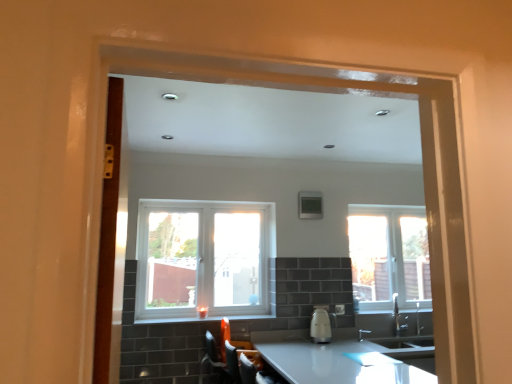
Image resolution: width=512 pixels, height=384 pixels. What do you see at coordinates (202, 258) in the screenshot? I see `white plastic window at center, which ranks as the 2th window in back-to-front order` at bounding box center [202, 258].

Measure the distance between white glossy kettle at center and camera.

white glossy kettle at center is 3.41 meters away from camera.

Where is `clear glass window at right, the second window viewed from the front`? clear glass window at right, the second window viewed from the front is located at coordinates (389, 255).

Image resolution: width=512 pixels, height=384 pixels. What are the coordinates of `white plastic window at center, arranged as the first window when viewed from the left` in the screenshot? It's located at (202, 258).

Which is behind, point (204, 238) or point (321, 316)?

Positioned behind is point (204, 238).

What's the angular difference between white plastic window at center, which ranks as the 2th window in back-to-front order, and white glossy kettle at center's facing directions?

They differ by 0.00149 degrees in their facing directions.

Are white plastic window at center, arranged as the first window when viewed from the left, and white glossy kettle at center located far from each other?

Yes, white plastic window at center, arranged as the first window when viewed from the left, and white glossy kettle at center are quite far apart.

Based on the photo, between white glossy kettle at center and white plastic window at center, which ranks as the 2th window in back-to-front order, which one has less height?

white glossy kettle at center is shorter.

Is white glossy kettle at center looking in the opposite direction of white plastic window at center, arranged as the 2th window when viewed from the right?

white glossy kettle at center is not turned away from white plastic window at center, arranged as the 2th window when viewed from the right.

Considering the sizes of objects white glossy kettle at center and white plastic window at center, the first window positioned from the front, in the image provided, who is thinner, white glossy kettle at center or white plastic window at center, the first window positioned from the front,?

white plastic window at center, the first window positioned from the front, is thinner.

From the picture: Does white glossy window sill at center come behind white glossy countertop at lower center?

Yes, white glossy window sill at center is behind white glossy countertop at lower center.

From a real-world perspective, is white glossy window sill at center physically below white glossy countertop at lower center?

Incorrect, from a real-world perspective, white glossy window sill at center is higher than white glossy countertop at lower center.

Is white glossy window sill at center far from white glossy countertop at lower center?

They are positioned close to each other.

What's the angular difference between white glossy window sill at center and white glossy countertop at lower center's facing directions?

There is a 89.9-degree angle between the facing directions of white glossy window sill at center and white glossy countertop at lower center.

Between white glossy countertop at lower center and white glossy kettle at center, which one has larger size?

white glossy countertop at lower center is bigger.

Looking at this image, from the image's perspective, is white glossy countertop at lower center on white glossy kettle at center?

No, from the image's perspective, white glossy countertop at lower center is not over white glossy kettle at center.

Which of these two, white glossy countertop at lower center or white glossy kettle at center, stands shorter?

white glossy kettle at center is shorter.

Is white glossy countertop at lower center with white glossy kettle at center?

No, white glossy countertop at lower center is not beside white glossy kettle at center.

How distant is clear glass window at right, which ranks as the second window in left-to-right order, from white plastic window at center, arranged as the first window when viewed from the left?

clear glass window at right, which ranks as the second window in left-to-right order, is 1.32 meters from white plastic window at center, arranged as the first window when viewed from the left.

Is clear glass window at right, which ranks as the 1th window in back-to-front order, aimed at white plastic window at center, the first window positioned from the front?

No, clear glass window at right, which ranks as the 1th window in back-to-front order, is not facing towards white plastic window at center, the first window positioned from the front.

Can you confirm if clear glass window at right, which ranks as the second window in left-to-right order, is smaller than white plastic window at center, the first window positioned from the front?

No.

Does clear glass window at right, which ranks as the second window in left-to-right order, contain white plastic window at center, arranged as the 2th window when viewed from the right?

No, white plastic window at center, arranged as the 2th window when viewed from the right, is not inside clear glass window at right, which ranks as the second window in left-to-right order.

Who is smaller, clear glass window at right, the second window viewed from the front, or white glossy kettle at center?

white glossy kettle at center.

Which is in front, clear glass window at right, which ranks as the 1th window in back-to-front order, or white glossy kettle at center?

white glossy kettle at center is in front.

Which is more to the left, clear glass window at right, the second window viewed from the front, or white glossy kettle at center?

white glossy kettle at center.

From the image's perspective, which is below, clear glass window at right, which ranks as the 1th window in back-to-front order, or white glossy kettle at center?

From the image's view, white glossy kettle at center is below.

From a real-world perspective, starting from the white glossy window sill at center, which window is the 1st one vertically above it? Please provide its 2D coordinates.

[(389, 255)]

From a real-world perspective, who is located lower, clear glass window at right, which ranks as the second window in left-to-right order, or white glossy window sill at center?

white glossy window sill at center.

What's the angular difference between clear glass window at right, which ranks as the second window in left-to-right order, and white glossy window sill at center's facing directions?

0.39 degrees.

Is clear glass window at right, the second window viewed from the front, positioned with its back to white glossy window sill at center?

No, clear glass window at right, the second window viewed from the front, is not facing away from white glossy window sill at center.

The image size is (512, 384). I want to click on appliance in front of the white plastic window at center, arranged as the 2th window when viewed from the right, so click(320, 325).

The width and height of the screenshot is (512, 384). Identify the location of appliance below the white plastic window at center, arranged as the 2th window when viewed from the right (from the image's perspective). click(x=320, y=325).

Considering their positions, is clear glass window at right, the second window viewed from the front, positioned closer to white glossy window sill at center than white glossy kettle at center?

Based on the image, white glossy kettle at center appears to be nearer to white glossy window sill at center.

Based on their spatial positions, is white glossy window sill at center or white glossy countertop at lower center further from clear glass window at right, which ranks as the 1th window in back-to-front order?

white glossy window sill at center is further to clear glass window at right, which ranks as the 1th window in back-to-front order.

Based on their spatial positions, is clear glass window at right, which ranks as the second window in left-to-right order, or white glossy window sill at center further from white glossy kettle at center?

clear glass window at right, which ranks as the second window in left-to-right order, is positioned further to the anchor white glossy kettle at center.

Which object lies nearer to the anchor point white glossy kettle at center, white glossy countertop at lower center or white glossy window sill at center?

white glossy countertop at lower center.

Looking at the image, which one is located further to white glossy kettle at center, white plastic window at center, the first window positioned from the front, or white glossy window sill at center?

Among the two, white plastic window at center, the first window positioned from the front, is located further to white glossy kettle at center.

From the image, which object appears to be farther from clear glass window at right, which ranks as the 1th window in back-to-front order, white glossy countertop at lower center or white glossy window sill at center?

white glossy window sill at center.

From the image, which object appears to be nearer to white glossy window sill at center, clear glass window at right, the second window viewed from the front, or white glossy countertop at lower center?

white glossy countertop at lower center is positioned closer to the anchor white glossy window sill at center.

Considering their positions, is white glossy kettle at center positioned further to white glossy countertop at lower center than white plastic window at center, arranged as the first window when viewed from the left?

white plastic window at center, arranged as the first window when viewed from the left, is further to white glossy countertop at lower center.

At what (x,y) coordinates should I click in order to perform the action: click on window sill located between white plastic window at center, arranged as the first window when viewed from the left, and clear glass window at right, which ranks as the second window in left-to-right order, in the left-right direction. Please return your answer as a coordinate pair (x, y). Image resolution: width=512 pixels, height=384 pixels. Looking at the image, I should click on (204, 319).

Where is `window sill situated between white plastic window at center, arranged as the first window when viewed from the left, and white glossy kettle at center from left to right`? This screenshot has height=384, width=512. window sill situated between white plastic window at center, arranged as the first window when viewed from the left, and white glossy kettle at center from left to right is located at coordinates (204, 319).

This screenshot has height=384, width=512. What are the coordinates of `window sill positioned between white glossy countertop at lower center and white plastic window at center, which ranks as the 2th window in back-to-front order, from near to far` in the screenshot? It's located at (204, 319).

Identify the location of countertop between white glossy window sill at center and clear glass window at right, which appears as the 1th window when viewed from the right, from left to right. (342, 360).